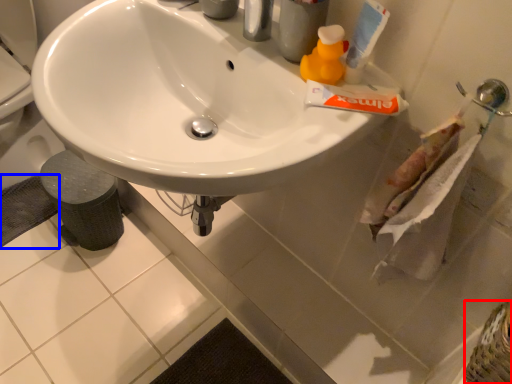
Question: Which point is closer to the camera, basket (highlighted by a red box) or bath mat (highlighted by a blue box)?

Choices:
 (A) basket
 (B) bath mat

Answer: (A)